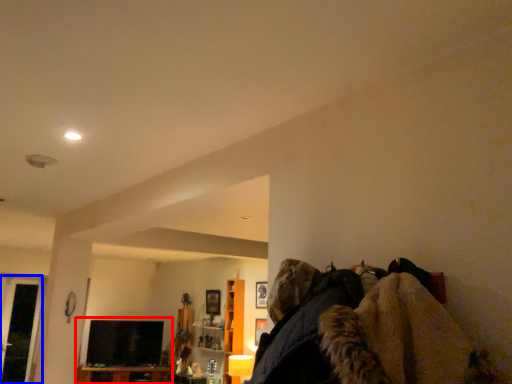
Question: Among these objects, which one is nearest to the camera, entertainment center (highlighted by a red box) or glass door (highlighted by a blue box)?

Choices:
 (A) entertainment center
 (B) glass door

Answer: (B)